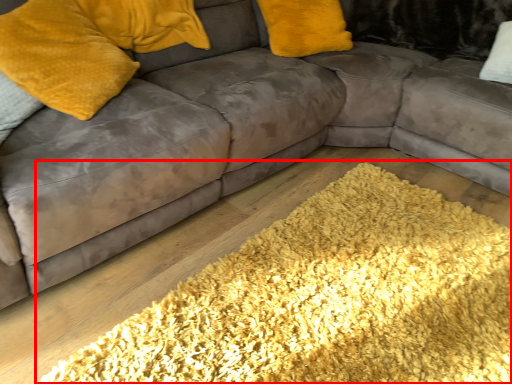
Question: From the image's perspective, what is the correct spatial positioning of mat (annotated by the red box) in reference to pillow?

Choices:
 (A) above
 (B) below

Answer: (B)